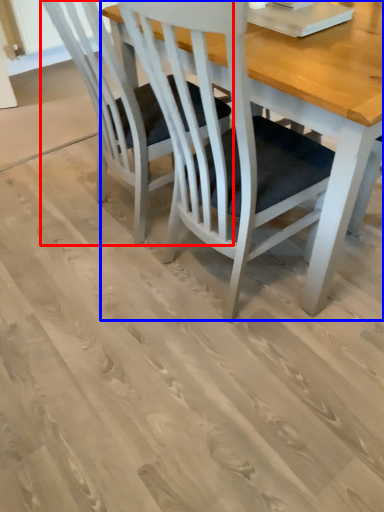
Question: Which of the following is the closest to the observer, chair (highlighted by a red box) or table (highlighted by a blue box)?

Choices:
 (A) chair
 (B) table

Answer: (B)